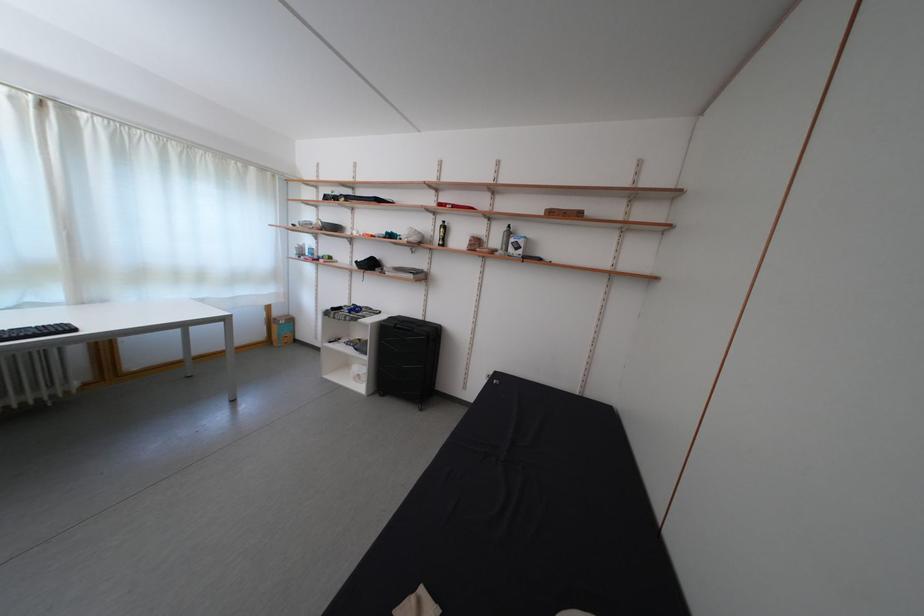
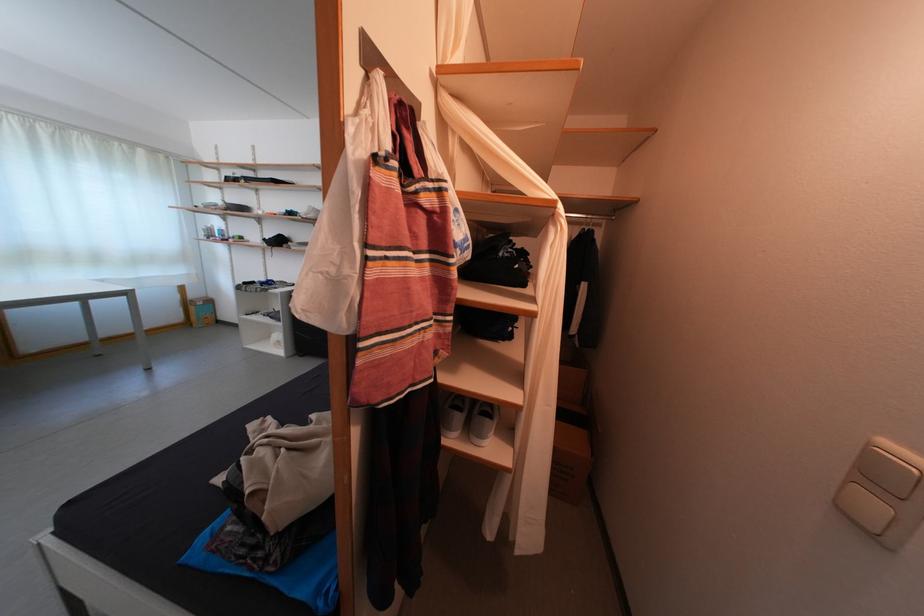
Locate, in the second image, the point that corresponds to pixel 285 320 in the first image.

(201, 302)